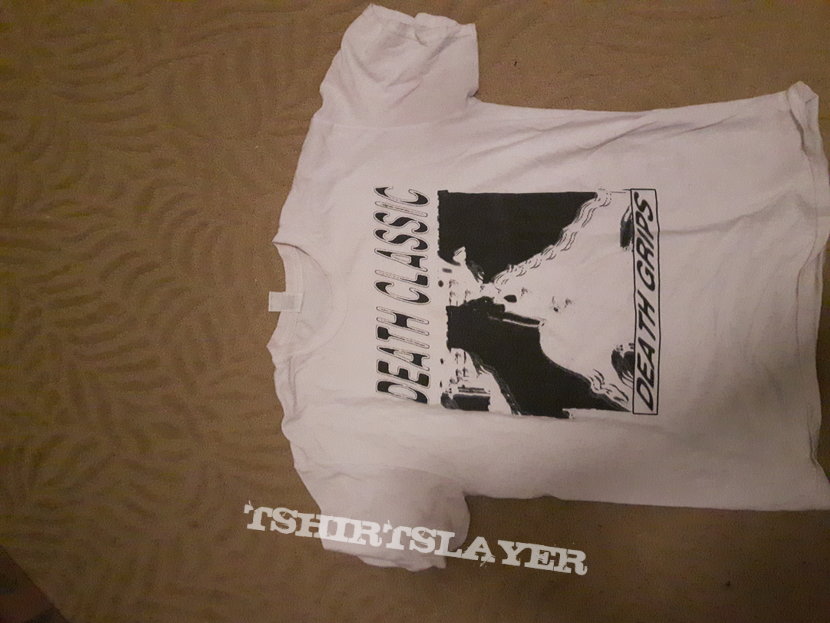
The width and height of the screenshot is (830, 623). Identify the location of off-white floral fabric. (123, 319), (544, 596).